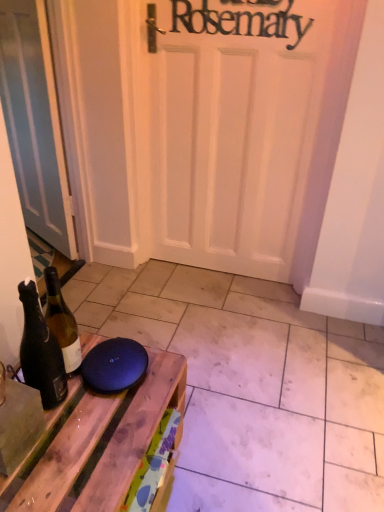
Question: In terms of width, does matte white door at left look wider or thinner when compared to matte wood tile at lower center?

Choices:
 (A) wide
 (B) thin

Answer: (B)

Question: Is matte white door at left bigger or smaller than matte wood tile at lower center?

Choices:
 (A) big
 (B) small

Answer: (B)

Question: Based on their relative distances, which object is farther from the matte wood tile at lower center?

Choices:
 (A) dark brown glass bottle at left
 (B) matte white door at left
 (C) wooden table at lower left

Answer: (B)

Question: Based on their relative distances, which object is nearer to the matte wood tile at lower center?

Choices:
 (A) wooden table at lower left
 (B) matte white door at left
 (C) dark brown glass bottle at left

Answer: (A)